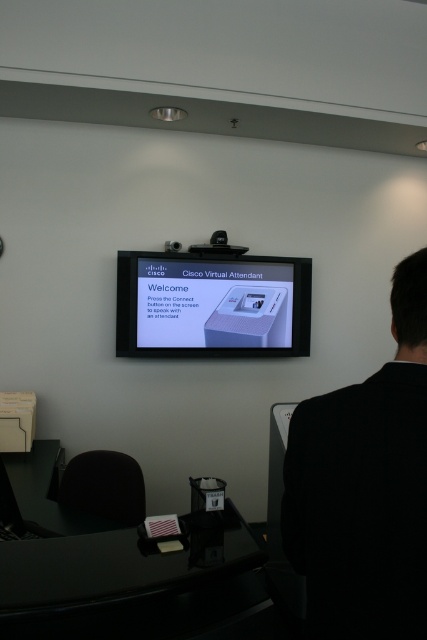
Describe the element at coordinates (365, 486) in the screenshot. The image size is (427, 640). I see `black fabric back at right` at that location.

Does black fabric back at right appear over black glossy table at lower center?

Yes.

At what (x,y) coordinates should I click in order to perform the action: click on black fabric back at right. Please return your answer as a coordinate pair (x, y). The height and width of the screenshot is (640, 427). Looking at the image, I should click on (365, 486).

You are a GUI agent. You are given a task and a screenshot of the screen. Output one action in this format:
    pyautogui.click(x=<x>, y=<y>)
    Task: Click on the black fabric back at right
    Image resolution: width=427 pixels, height=640 pixels.
    Given the screenshot: What is the action you would take?
    coord(365,486)

Is black glossy table at lower center above black plastic projector at upper center?

No.

Does black glossy table at lower center appear under black plastic projector at upper center?

Yes, black glossy table at lower center is below black plastic projector at upper center.

The width and height of the screenshot is (427, 640). I want to click on black glossy table at lower center, so click(128, 584).

Who is positioned more to the right, black fabric back at right or black plastic projector at upper center?

From the viewer's perspective, black fabric back at right appears more on the right side.

Between black fabric back at right and black plastic projector at upper center, which one is positioned higher?

black plastic projector at upper center is higher up.

Which is behind, point (370, 394) or point (243, 252)?

Point (243, 252)

Locate an element on the screen. black fabric back at right is located at coordinates click(x=365, y=486).